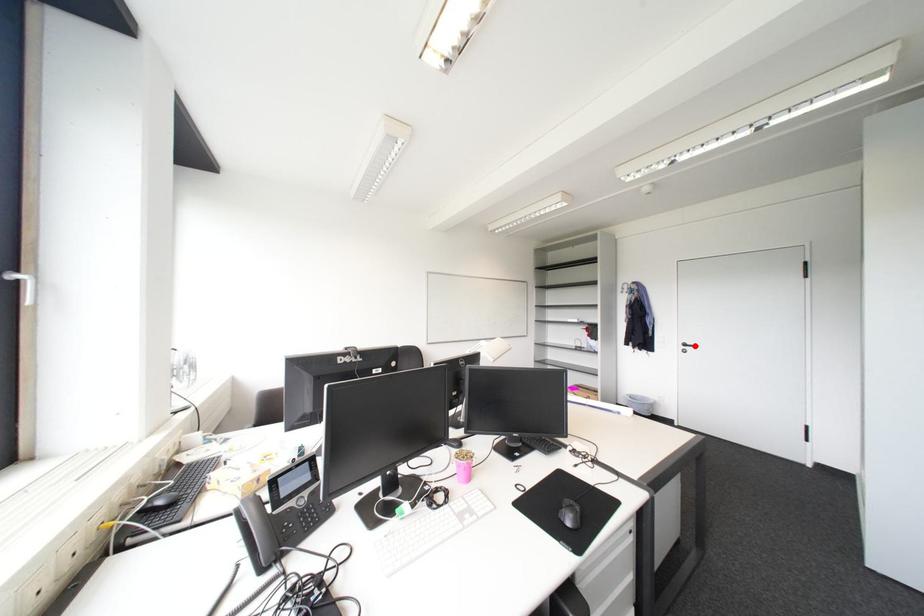
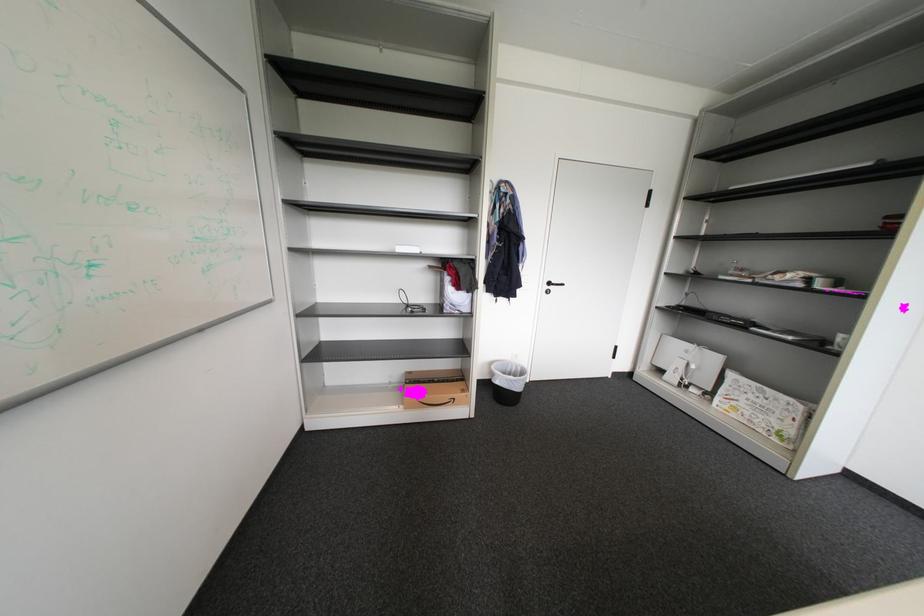
Question: I am providing you with two images of the same scene from different viewpoints. A red point is shown in image1. For the corresponding object point in image2, is it positioned nearer or farther from the camera?

Choices:
 (A) Nearer
 (B) Farther

Answer: (A)